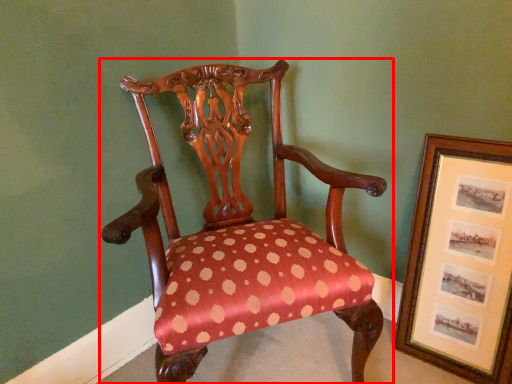
Question: From the image, what is the correct spatial relationship of chair (annotated by the red box) in relation to picture frame?

Choices:
 (A) right
 (B) left

Answer: (B)